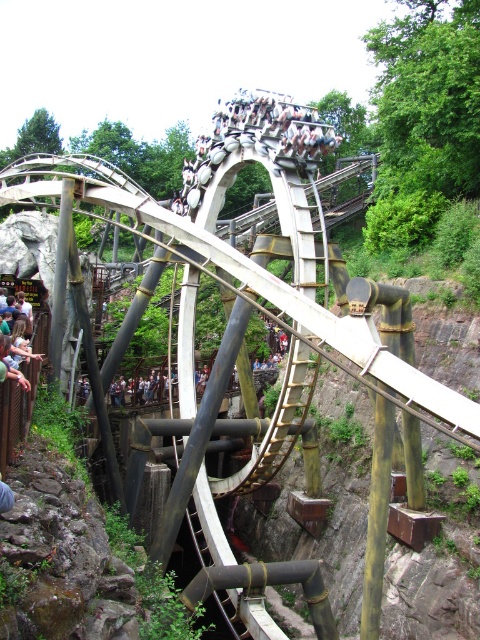
Between point (279, 147) and point (6, 365), which one is positioned in front?

Positioned in front is point (6, 365).

Does metallic silver roller coaster at center have a greater height compared to light brown wooden sign at lower left?

Yes, metallic silver roller coaster at center is taller than light brown wooden sign at lower left.

What do you see at coordinates (255, 141) in the screenshot? The image size is (480, 640). I see `metallic silver roller coaster at center` at bounding box center [255, 141].

Where is `metallic silver roller coaster at center`? metallic silver roller coaster at center is located at coordinates (255, 141).